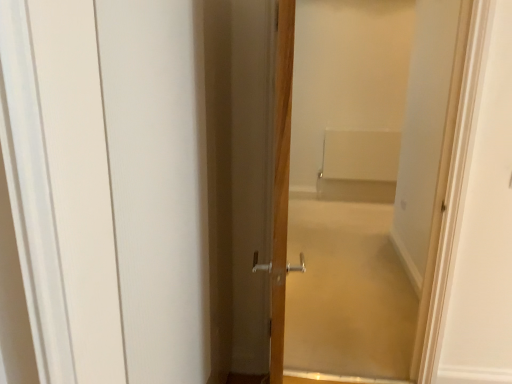
Question: Does wooden door at center, marked as the 1th door in a left-to-right arrangement, touch white matte bath at center?

Choices:
 (A) yes
 (B) no

Answer: (B)

Question: Does wooden door at center, marked as the 1th door in a left-to-right arrangement, appear on the left side of white matte bath at center?

Choices:
 (A) yes
 (B) no

Answer: (A)

Question: Can you confirm if wooden door at center, positioned as the 2th door in right-to-left order, is positioned to the right of white matte bath at center?

Choices:
 (A) yes
 (B) no

Answer: (B)

Question: From a real-world perspective, is wooden door at center, positioned as the 2th door in right-to-left order, positioned under white matte bath at center based on gravity?

Choices:
 (A) yes
 (B) no

Answer: (B)

Question: Is wooden door at center, marked as the 1th door in a left-to-right arrangement, not close to white matte bath at center?

Choices:
 (A) yes
 (B) no

Answer: (A)

Question: Is wooden door at center, marked as the 1th door in a left-to-right arrangement, behind white matte bath at center?

Choices:
 (A) no
 (B) yes

Answer: (A)

Question: From the image's perspective, is white matte bath at center below wooden door at center, which is counted as the second door, starting from the left?

Choices:
 (A) yes
 (B) no

Answer: (B)

Question: Is white matte bath at center looking in the opposite direction of wooden door at center, which is counted as the second door, starting from the left?

Choices:
 (A) yes
 (B) no

Answer: (B)

Question: Is the depth of white matte bath at center less than that of wooden door at center, placed as the 1th door when sorted from right to left?

Choices:
 (A) no
 (B) yes

Answer: (A)

Question: Is white matte bath at center completely or partially outside of wooden door at center, which is counted as the second door, starting from the left?

Choices:
 (A) no
 (B) yes

Answer: (B)

Question: Does white matte bath at center have a smaller size compared to wooden door at center, placed as the 1th door when sorted from right to left?

Choices:
 (A) yes
 (B) no

Answer: (A)

Question: From a real-world perspective, is white matte bath at center positioned under wooden door at center, placed as the 1th door when sorted from right to left, based on gravity?

Choices:
 (A) yes
 (B) no

Answer: (A)

Question: Is wooden door at center, marked as the 1th door in a left-to-right arrangement, positioned before white matte barn door at left?

Choices:
 (A) yes
 (B) no

Answer: (B)